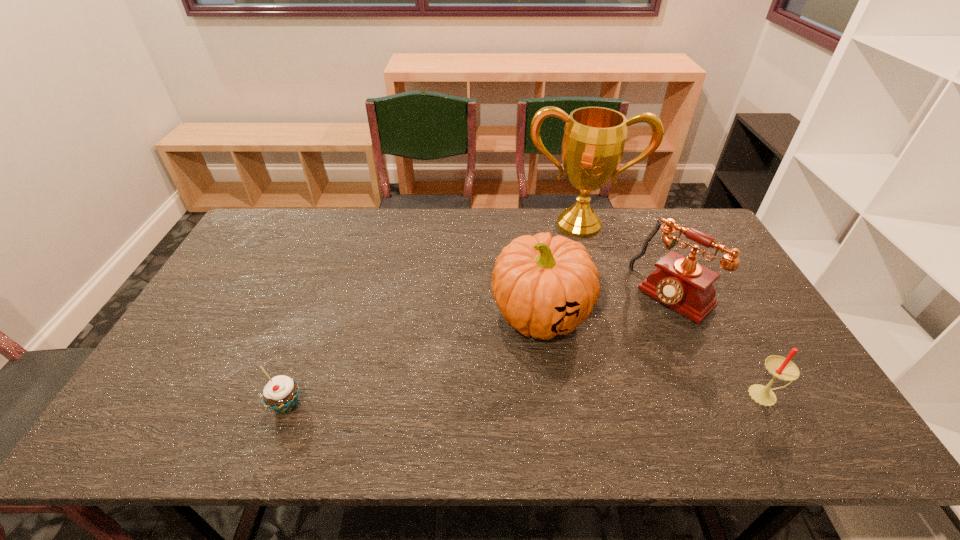
Find the location of a particular element. This screenshot has width=960, height=540. vacant area that lies between the pumpkin and the telephone is located at coordinates (607, 305).

Identify the location of free point between the telephone and the farthest object. (626, 260).

At what (x,y) coordinates should I click in order to perform the action: click on unoccupied position between the pumpkin and the shortest object. Please return your answer as a coordinate pair (x, y). This screenshot has height=540, width=960. Looking at the image, I should click on click(x=414, y=359).

Identify the location of free spot between the farthest object and the fourth tallest object. The height and width of the screenshot is (540, 960). 673,309.

This screenshot has width=960, height=540. In order to click on empty location between the telephone and the candle in this screenshot , I will do [x=719, y=346].

This screenshot has height=540, width=960. I want to click on empty space between the farthest object and the cupcake, so click(433, 314).

You are a GUI agent. You are given a task and a screenshot of the screen. Output one action in this format:
    pyautogui.click(x=<x>, y=<y>)
    Task: Click on the free point between the telephone and the pumpkin
    
    Given the screenshot: What is the action you would take?
    pyautogui.click(x=607, y=305)

This screenshot has height=540, width=960. I want to click on free space that is in between the farthest object and the telephone, so click(x=626, y=260).

Identify the location of object that is the second closest to the fourth tallest object. The width and height of the screenshot is (960, 540). (543, 286).

This screenshot has height=540, width=960. Identify the location of object that is the fourth nearest to the pumpkin. (281, 393).